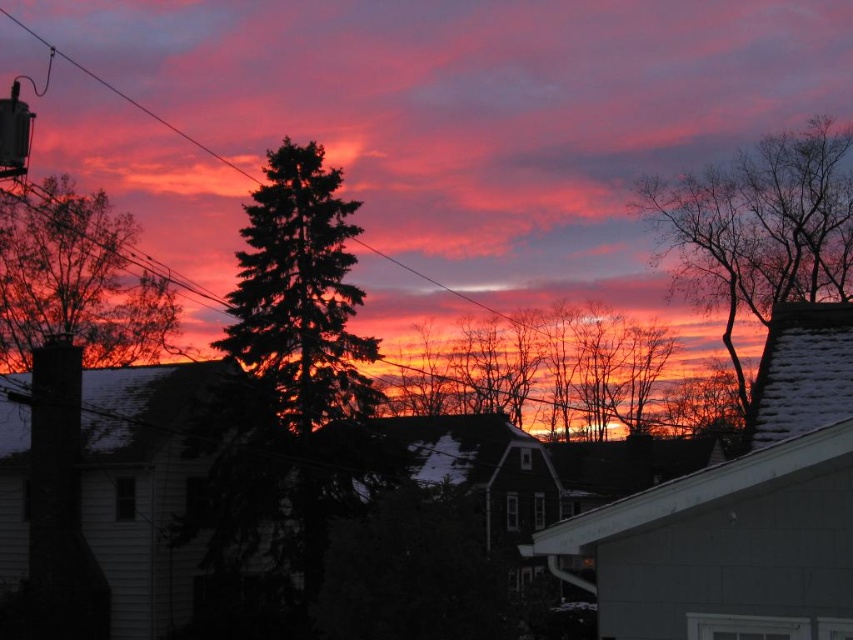
Question: Does silhouette bare tree at center come in front of bare branches at upper right?

Choices:
 (A) yes
 (B) no

Answer: (B)

Question: Estimate the real-world distances between objects in this image. Which object is closer to the silhouette evergreen tree at left?

Choices:
 (A) silhouette bare tree at center
 (B) pink matte cloud at upper center
 (C) green textured pine tree at center

Answer: (A)

Question: Estimate the real-world distances between objects in this image. Which object is farther from the pink matte cloud at upper center?

Choices:
 (A) silhouette evergreen tree at left
 (B) silhouette bare tree at center

Answer: (A)

Question: Can you confirm if silhouette bare tree at center is thinner than bare branches at upper right?

Choices:
 (A) yes
 (B) no

Answer: (B)

Question: Can you confirm if pink matte cloud at upper center is wider than silhouette bare tree at center?

Choices:
 (A) yes
 (B) no

Answer: (A)

Question: Which point is farther to the camera?

Choices:
 (A) (120, 250)
 (B) (590, 380)
 (C) (787, 266)
 (D) (352, 264)

Answer: (B)